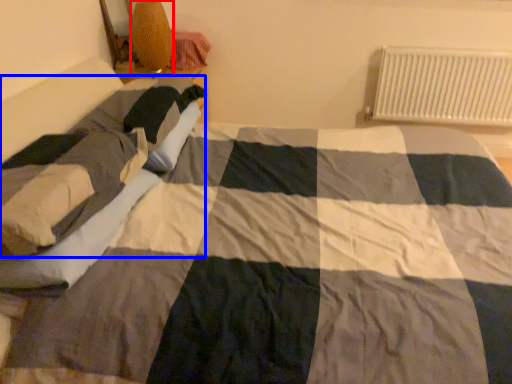
Question: Which object is closer to the camera taking this photo, lamp (highlighted by a red box) or person (highlighted by a blue box)?

Choices:
 (A) lamp
 (B) person

Answer: (B)